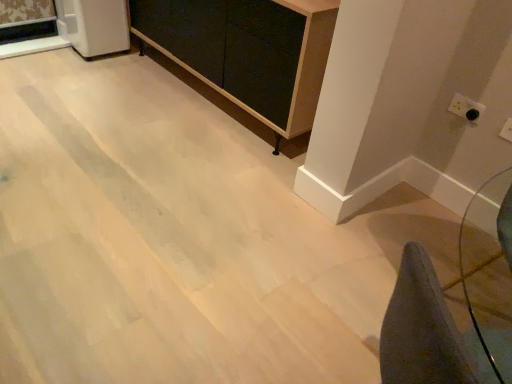
Question: Is white glossy refrigerator at upper left smaller than white plastic electric outlet at upper right, placed as the 1th electric outlet when sorted from front to back?

Choices:
 (A) no
 (B) yes

Answer: (A)

Question: Considering the relative positions of white glossy refrigerator at upper left and white plastic electric outlet at upper right, which is the 2th electric outlet from left to right, in the image provided, is white glossy refrigerator at upper left to the left of white plastic electric outlet at upper right, which is the 2th electric outlet from left to right, from the viewer's perspective?

Choices:
 (A) yes
 (B) no

Answer: (A)

Question: From the image's perspective, is white glossy refrigerator at upper left over white plastic electric outlet at upper right, positioned as the 1th electric outlet in bottom-to-top order?

Choices:
 (A) no
 (B) yes

Answer: (B)

Question: Is white glossy refrigerator at upper left at the right side of white plastic electric outlet at upper right, which is the 1th electric outlet from right to left?

Choices:
 (A) yes
 (B) no

Answer: (B)

Question: Is white plastic electric outlet at upper right, the 2th electric outlet viewed from the back, completely or partially inside white glossy refrigerator at upper left?

Choices:
 (A) no
 (B) yes

Answer: (A)

Question: Is the position of white glossy refrigerator at upper left more distant than that of white plastic electric outlet at upper right, arranged as the 2th electric outlet when viewed from the top?

Choices:
 (A) no
 (B) yes

Answer: (B)

Question: Is white plastic electric outlet at upper right, the first electric outlet in the back-to-front sequence, positioned far away from white glossy refrigerator at upper left?

Choices:
 (A) yes
 (B) no

Answer: (A)

Question: Is white plastic electric outlet at upper right, placed as the 2th electric outlet when sorted from bottom to top, oriented away from white glossy refrigerator at upper left?

Choices:
 (A) no
 (B) yes

Answer: (A)

Question: From a real-world perspective, is white plastic electric outlet at upper right, the second electric outlet in the right-to-left sequence, physically below white glossy refrigerator at upper left?

Choices:
 (A) no
 (B) yes

Answer: (A)

Question: Is white plastic electric outlet at upper right, the first electric outlet in the back-to-front sequence, positioned before white glossy refrigerator at upper left?

Choices:
 (A) no
 (B) yes

Answer: (B)

Question: Is white plastic electric outlet at upper right, which appears as the second electric outlet when viewed from the front, thinner than white glossy refrigerator at upper left?

Choices:
 (A) no
 (B) yes

Answer: (B)

Question: From the image's perspective, is white plastic electric outlet at upper right, which is counted as the first electric outlet, starting from the top, located above white glossy refrigerator at upper left?

Choices:
 (A) yes
 (B) no

Answer: (B)

Question: Is white plastic electric outlet at upper right, which appears as the second electric outlet when viewed from the front, taller than white plastic electric outlet at upper right, arranged as the 2th electric outlet when viewed from the top?

Choices:
 (A) no
 (B) yes

Answer: (B)